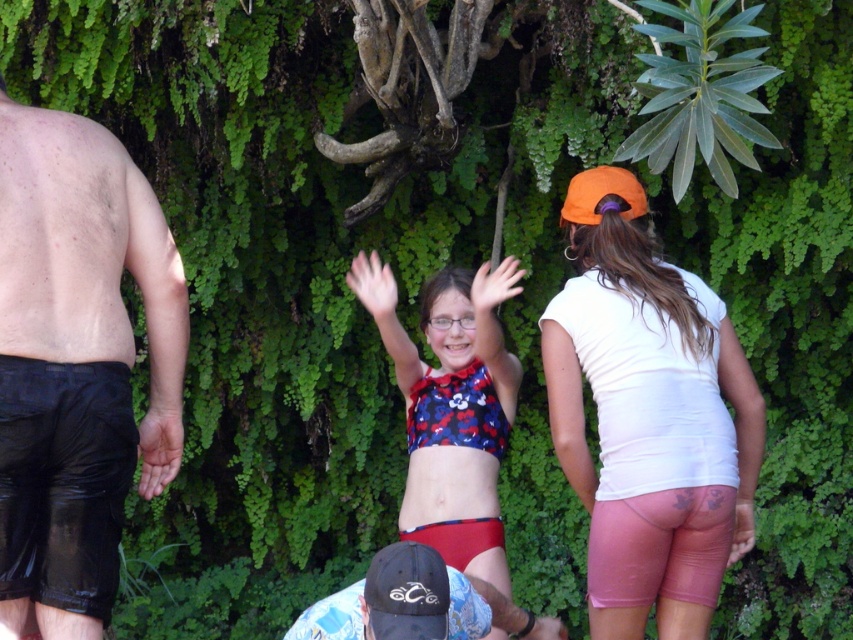
Question: Estimate the real-world distances between objects in this image. Which object is closer to the black cap at lower center?

Choices:
 (A) white matte shorts at right
 (B) black wet shorts at left

Answer: (A)

Question: Does white matte shorts at right appear on the left side of blue floral bikini top at center?

Choices:
 (A) no
 (B) yes

Answer: (A)

Question: Estimate the real-world distances between objects in this image. Which object is farther from the blue floral bikini top at center?

Choices:
 (A) white matte shorts at right
 (B) black wet shorts at left

Answer: (B)

Question: Is black wet shorts at left behind blue floral bikini top at center?

Choices:
 (A) no
 (B) yes

Answer: (A)

Question: Does white matte shorts at right have a larger size compared to black cap at lower center?

Choices:
 (A) no
 (B) yes

Answer: (A)

Question: Which object is farther from the camera taking this photo?

Choices:
 (A) blue floral bikini top at center
 (B) black cap at lower center

Answer: (A)